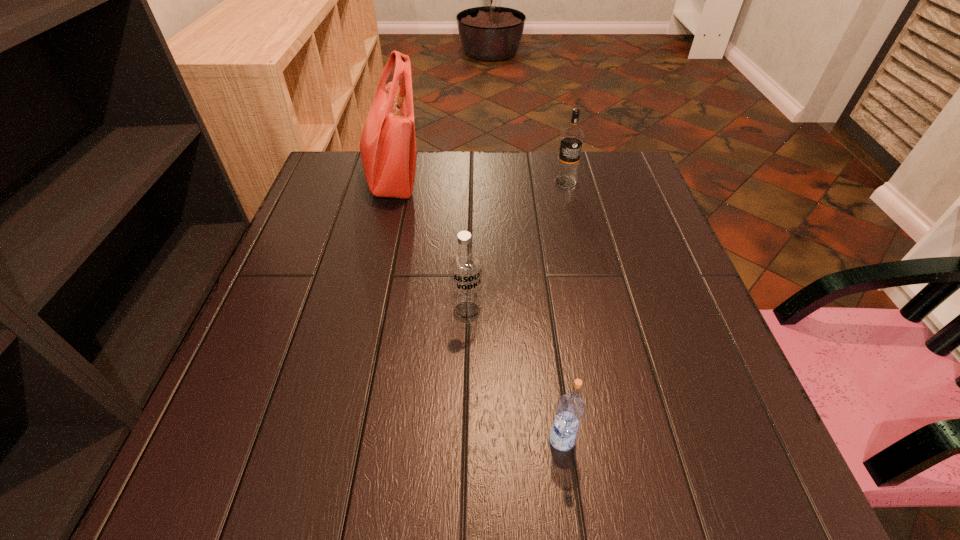
The image size is (960, 540). Find the location of `the tallest object`. the tallest object is located at coordinates (388, 145).

This screenshot has height=540, width=960. I want to click on handbag, so click(x=388, y=145).

Find the location of `the rightmost vodka`. the rightmost vodka is located at coordinates (571, 141).

Locate an element on the screen. the rightmost object is located at coordinates (571, 141).

This screenshot has height=540, width=960. What are the coordinates of `the second object from left to right` in the screenshot? It's located at (465, 264).

You are a GUI agent. You are given a task and a screenshot of the screen. Output one action in this format:
    pyautogui.click(x=<x>, y=<y>)
    Task: Click on the third farthest object
    The height and width of the screenshot is (540, 960).
    Given the screenshot: What is the action you would take?
    pyautogui.click(x=465, y=264)

You are a GUI agent. You are given a task and a screenshot of the screen. Output one action in this format:
    pyautogui.click(x=<x>, y=<y>)
    Task: Click on the second vodka from left to right
    The width and height of the screenshot is (960, 540).
    Given the screenshot: What is the action you would take?
    pyautogui.click(x=570, y=410)

Find the location of a particular element. the shortest vodka is located at coordinates (570, 410).

The image size is (960, 540). Find the location of `vacant space located on the front-facing side of the leftmost object`. vacant space located on the front-facing side of the leftmost object is located at coordinates (443, 179).

The height and width of the screenshot is (540, 960). Identify the location of free region located 0.090m on the label of the rightmost vodka. (571, 210).